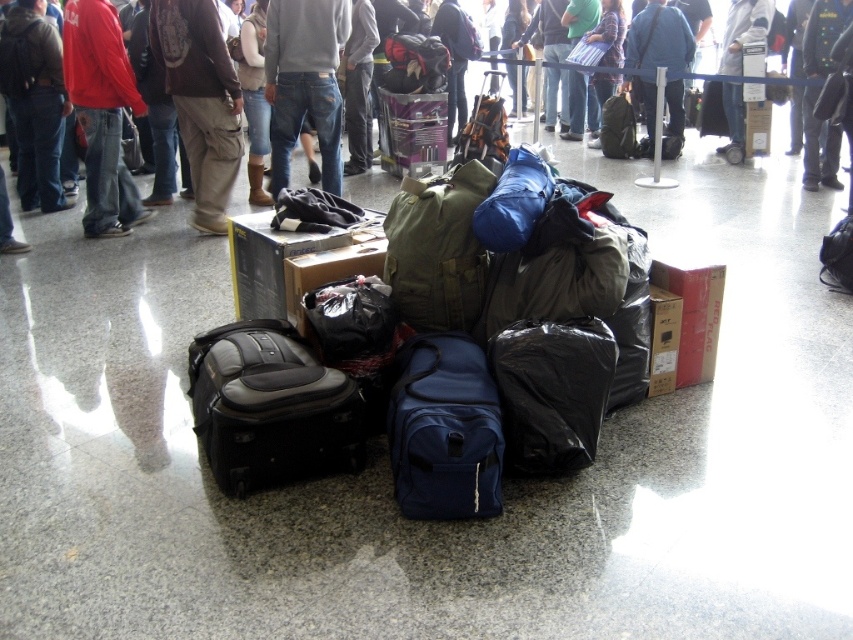
Question: Is matte black suitcase at center thinner than navy blue fabric backpack at center?

Choices:
 (A) no
 (B) yes

Answer: (A)

Question: Is matte black suitcase at center below red cotton hoodie at upper left?

Choices:
 (A) yes
 (B) no

Answer: (A)

Question: Among these objects, which one is farthest from the camera?

Choices:
 (A) navy blue fabric backpack at center
 (B) matte black backpack at center
 (C) red cotton hoodie at upper left
 (D) matte black suitcase at center

Answer: (B)

Question: Can you confirm if matte black suitcase at center is smaller than red cotton hoodie at upper left?

Choices:
 (A) no
 (B) yes

Answer: (B)

Question: Which object appears closest to the camera in this image?

Choices:
 (A) navy blue fabric backpack at center
 (B) matte black suitcase at center

Answer: (A)

Question: Which object is the farthest from the jeans at center?

Choices:
 (A) matte black backpack at center
 (B) navy blue fabric backpack at center
 (C) red cotton hoodie at upper left
 (D) matte black suitcase at center

Answer: (B)